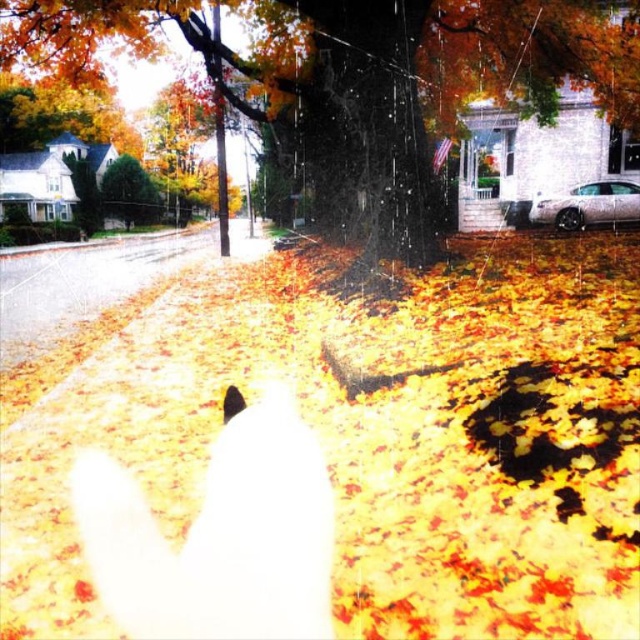
Is smooth bark tree at center below green textured bush at upper left?

Yes.

Does smooth bark tree at center have a lesser width compared to green textured bush at upper left?

In fact, smooth bark tree at center might be wider than green textured bush at upper left.

Measure the distance between smooth bark tree at center and camera.

They are 10.21 meters apart.

This screenshot has width=640, height=640. Identify the location of smooth bark tree at center. (364, 81).